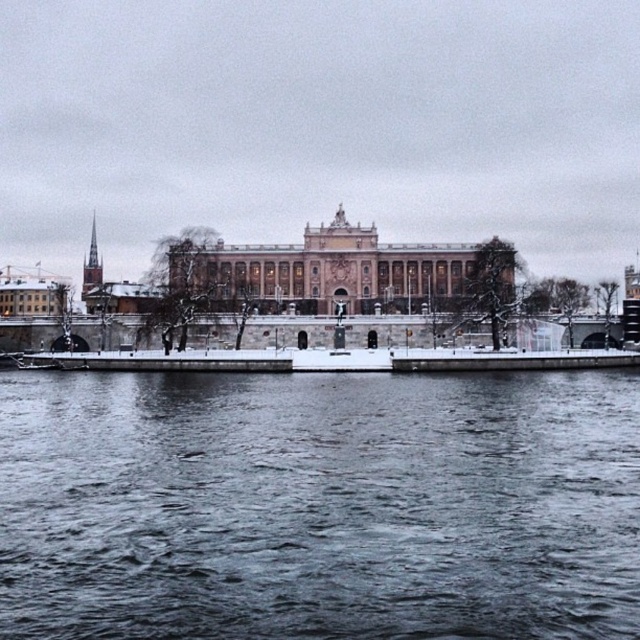
You are a tourist standing on a bridge that crosses the dark gray water at lower center. You want to take a photo of the pink stone building at center without any obstructions. Is the building visible from your current position?

The dark gray water at lower center is below the pink stone building at center, so yes, the building is visible from the bridge as it is positioned above the water.

You are a tourist standing on the dock and want to take a photo of the pink stone building at center and the dark gray water at lower center. Which object will appear larger in the photo?

The pink stone building at center will appear larger in the photo since it has a greater height than the dark gray water at lower center according to the description.

You are standing at the point marked as point [320,506]. What object is located exactly at that point?

The dark gray water at lower center is located exactly at point [320,506].